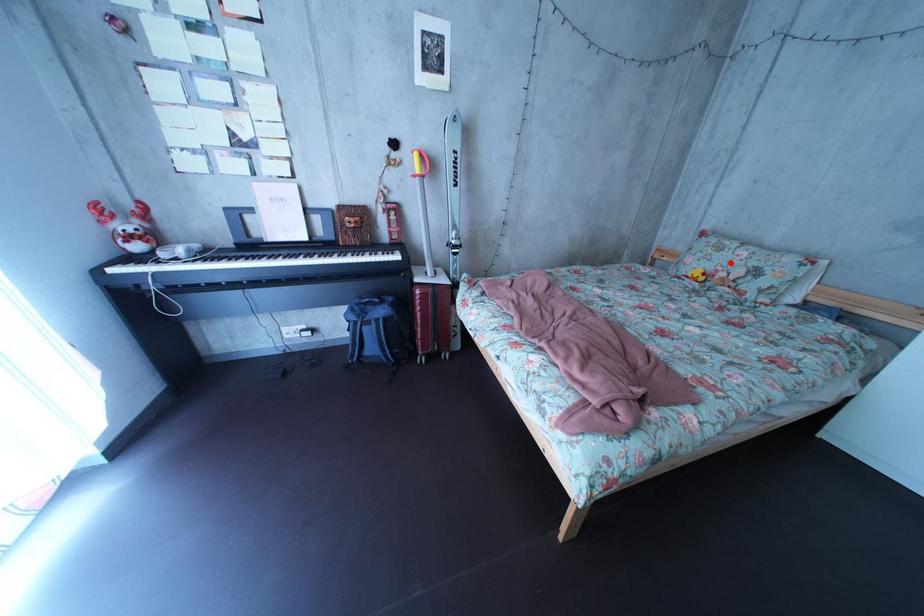
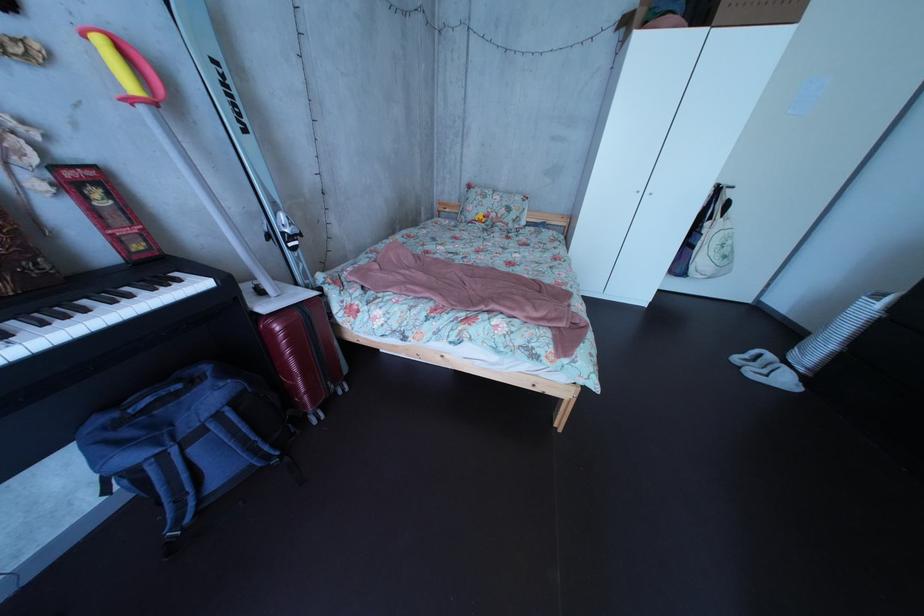
In the second image, find the point that corresponds to the highlighted location in the first image.

(499, 209)